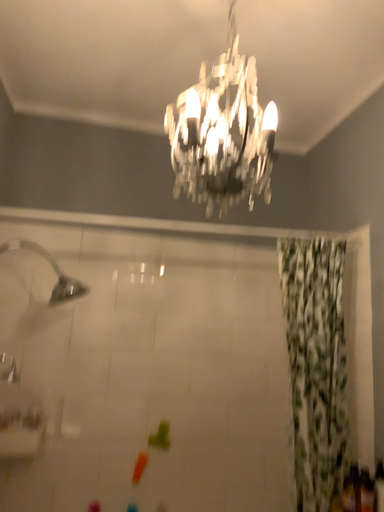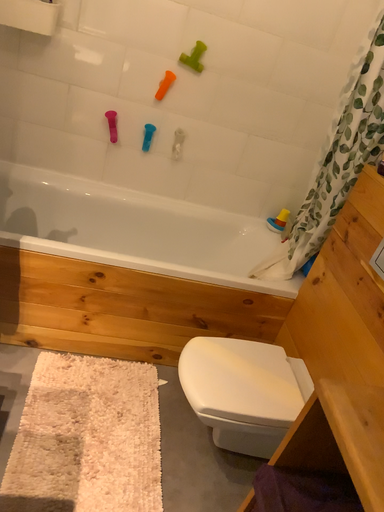
Question: How did the camera likely rotate when shooting the video?

Choices:
 (A) rotated downward
 (B) rotated upward

Answer: (A)